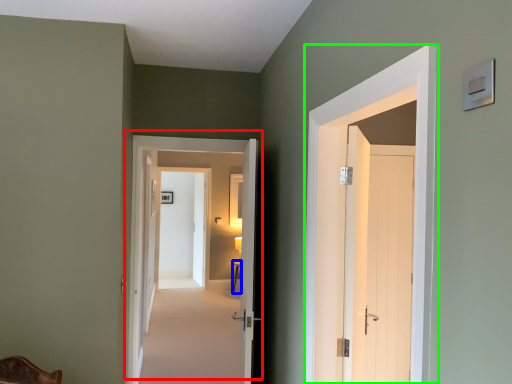
Question: Which object is positioned farthest from door (highlighted by a red box)? Select from table (highlighted by a blue box) and door (highlighted by a green box).

Choices:
 (A) table
 (B) door

Answer: (A)